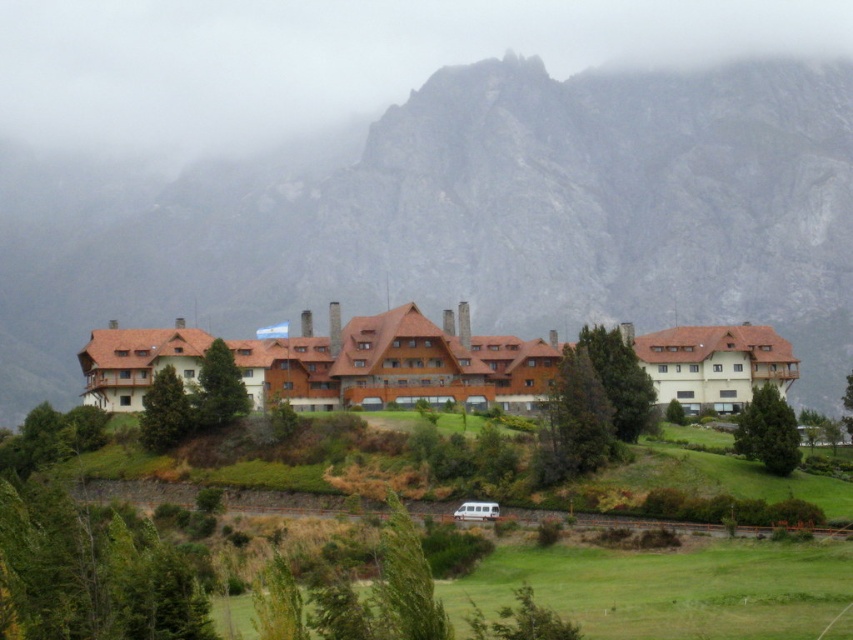
You are standing on the lawn in front of the building and looking towards the mountains. Which object is closer to the building, the rugged stone mountain at center or the foggy rock at upper center?

The rugged stone mountain at center is closer to the building because it is positioned under the foggy rock at upper center, meaning the foggy rock is higher up and farther away from the building.

You are planning to install a large billboard on the side of the rugged stone mountain at center and the foggy rock at upper center. Based on their widths, which location would be more suitable for the billboard?

The foggy rock at upper center has a greater width than the rugged stone mountain at center, making it more suitable for installing the billboard.